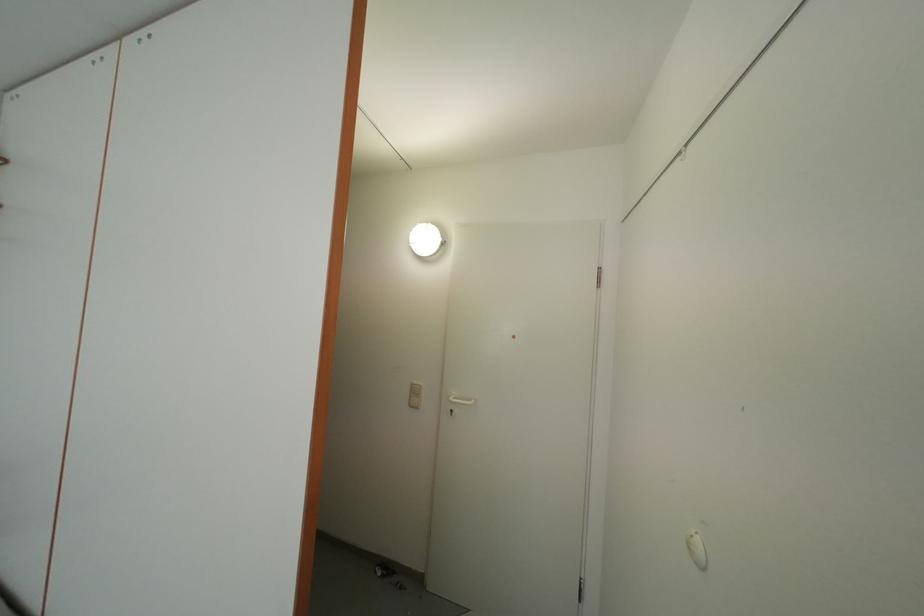
In order to click on white door handle in this screenshot , I will do `click(459, 400)`.